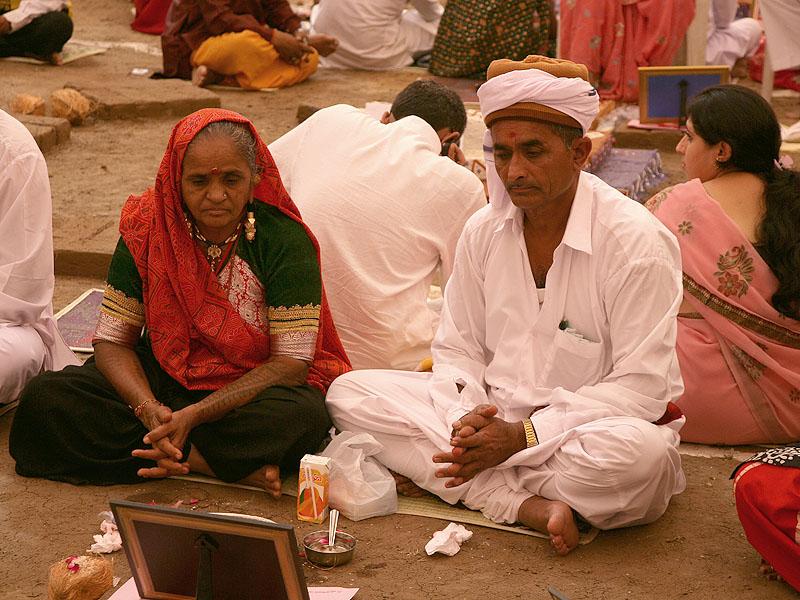
This screenshot has width=800, height=600. What are the coordinates of `picture frame holding up enclosed picture` in the screenshot? It's located at (221, 574), (662, 93).